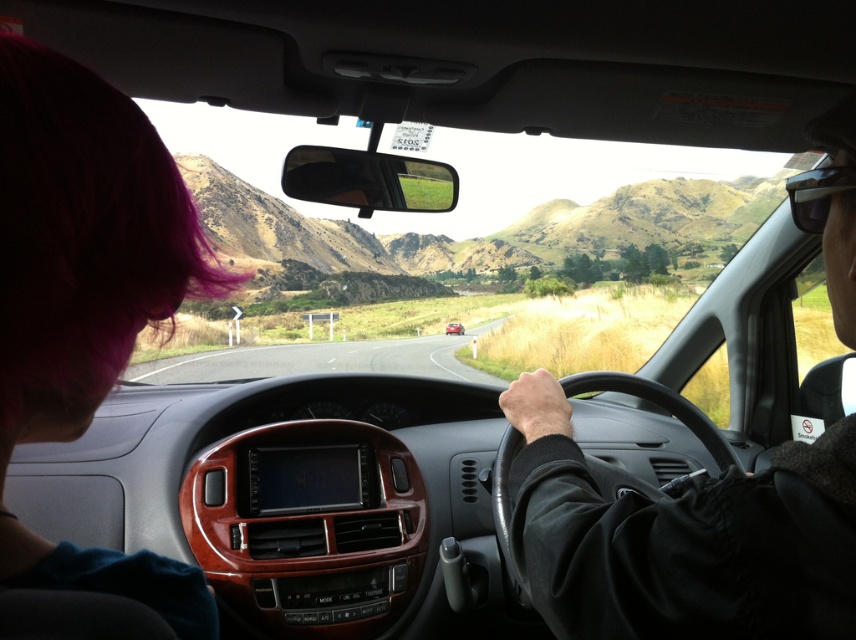
You are sitting in the passenger seat of the metallic red car at center and notice a black leather jacket at center. Which side of the car is the jacket located relative to the car?

The black leather jacket at center is positioned on the right side of the metallic red car at center, so it is on the right side of the car.

You are a passenger in the car and notice two objects in the scene. One is the pink hair at left and the other is the metallic red car at center. Which object is positioned higher relative to the other?

The pink hair at left is located above the metallic red car at center, so it is positioned higher than the metallic red car at center.